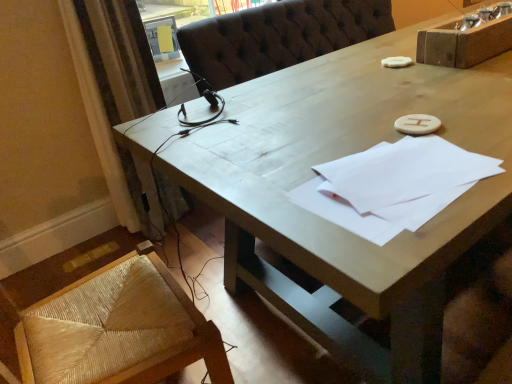
Question: Is white paper at center to the right of beige textured curtain at left from the viewer's perspective?

Choices:
 (A) no
 (B) yes

Answer: (B)

Question: From the image's perspective, is white paper at center located above beige textured curtain at left?

Choices:
 (A) yes
 (B) no

Answer: (B)

Question: Is the position of white paper at center more distant than that of beige textured curtain at left?

Choices:
 (A) yes
 (B) no

Answer: (B)

Question: Is the depth of white paper at center less than that of beige textured curtain at left?

Choices:
 (A) yes
 (B) no

Answer: (A)

Question: Is white paper at center positioned far away from beige textured curtain at left?

Choices:
 (A) no
 (B) yes

Answer: (B)

Question: Is white paper at center to the left of beige textured curtain at left from the viewer's perspective?

Choices:
 (A) no
 (B) yes

Answer: (A)

Question: Considering the relative positions of beige textured curtain at left and white paper at center in the image provided, is beige textured curtain at left in front of white paper at center?

Choices:
 (A) no
 (B) yes

Answer: (A)

Question: Considering the relative positions of beige textured curtain at left and white paper at center in the image provided, is beige textured curtain at left behind white paper at center?

Choices:
 (A) yes
 (B) no

Answer: (A)

Question: Is beige textured curtain at left to the left of white paper at center from the viewer's perspective?

Choices:
 (A) yes
 (B) no

Answer: (A)

Question: From a real-world perspective, is beige textured curtain at left physically below white paper at center?

Choices:
 (A) no
 (B) yes

Answer: (B)

Question: Is beige textured curtain at left next to white paper at center and touching it?

Choices:
 (A) no
 (B) yes

Answer: (A)

Question: Is beige textured curtain at left aimed at white paper at center?

Choices:
 (A) no
 (B) yes

Answer: (B)

Question: In the image, is white paper at center on the left side or the right side of beige textured curtain at left?

Choices:
 (A) right
 (B) left

Answer: (A)